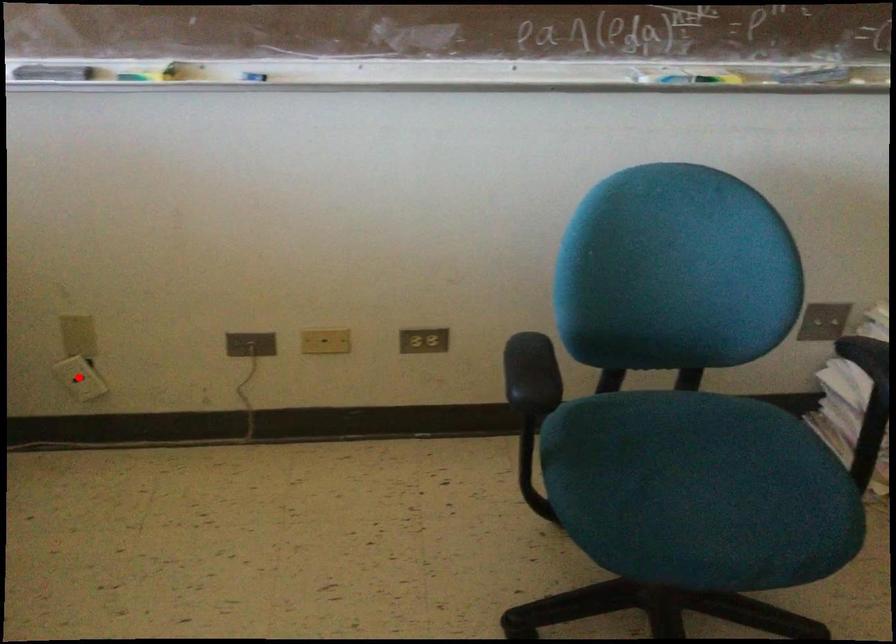
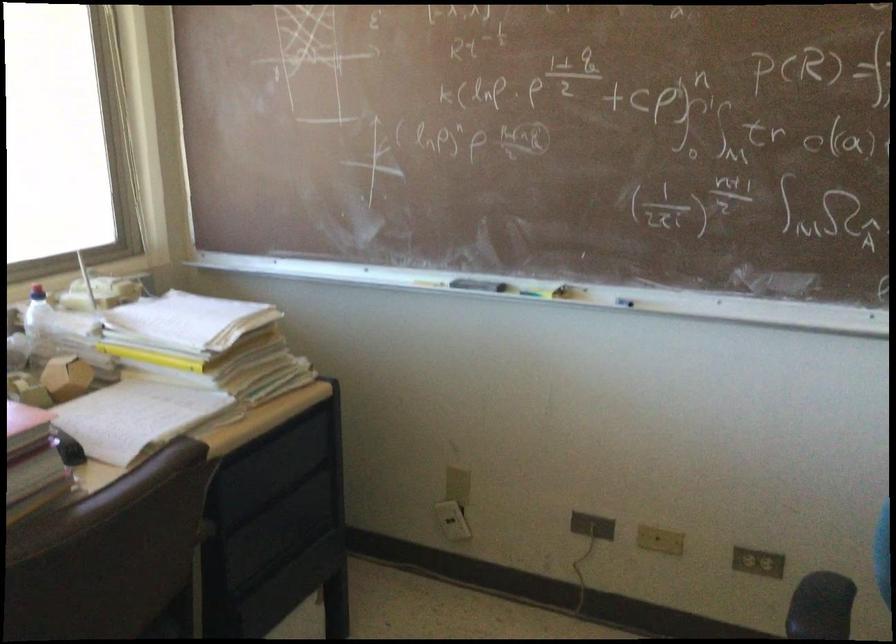
Find the pixel in the second image that matches the highlighted location in the first image.

(452, 520)